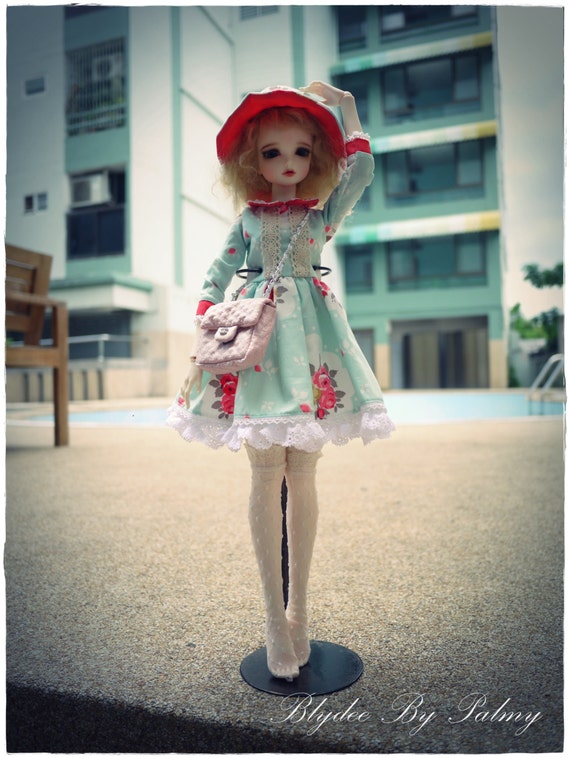
Where is `doll`? Image resolution: width=570 pixels, height=758 pixels. doll is located at coordinates (280, 274).